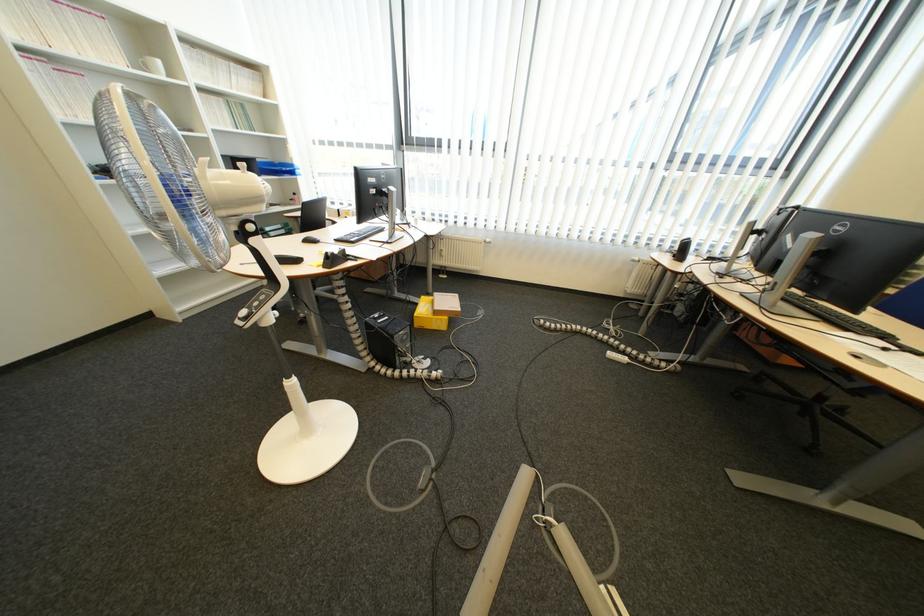
The location [310,238] corresponds to which object?

It corresponds to the black computer mouse in the image.